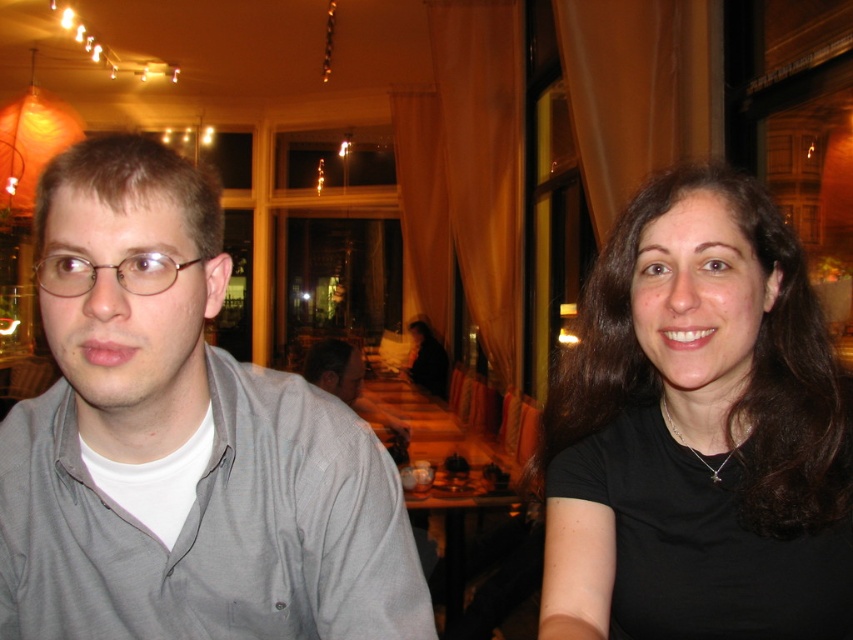
Question: Which point is farther to the camera?

Choices:
 (A) (723, 609)
 (B) (173, 204)

Answer: (A)

Question: Can you confirm if black matte hair at upper right is positioned above light gray shirt at center?

Choices:
 (A) no
 (B) yes

Answer: (B)

Question: Which point is closer to the camera?

Choices:
 (A) (321, 360)
 (B) (267, 554)
 (C) (68, 262)

Answer: (C)

Question: Which object appears farthest from the camera in this image?

Choices:
 (A) matte plastic glasses at left
 (B) gray cotton shirt at left
 (C) wooden table at center

Answer: (C)

Question: Is gray cotton shirt at left in front of matte plastic glasses at left?

Choices:
 (A) yes
 (B) no

Answer: (A)

Question: Is gray cotton shirt at left behind black matte hair at upper right?

Choices:
 (A) no
 (B) yes

Answer: (A)